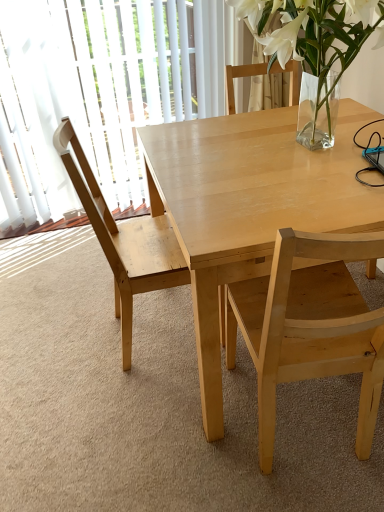
This screenshot has height=512, width=384. What are the coordinates of `vacant area that lies between light wood chair at left, which is the first chair from left to right, and light wood table at center` in the screenshot? It's located at (159, 385).